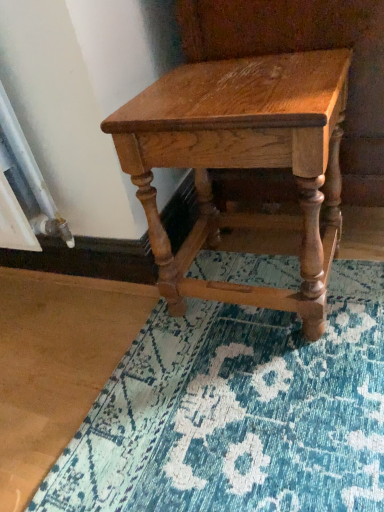
The image size is (384, 512). In order to click on shiny oak table at center in this screenshot , I will do `click(242, 163)`.

Measure the distance between point (149, 182) and camera.

Point (149, 182) is 26.54 inches from camera.

The height and width of the screenshot is (512, 384). Describe the element at coordinates (242, 163) in the screenshot. I see `shiny oak table at center` at that location.

Where is `shiny oak table at center`? shiny oak table at center is located at coordinates (242, 163).